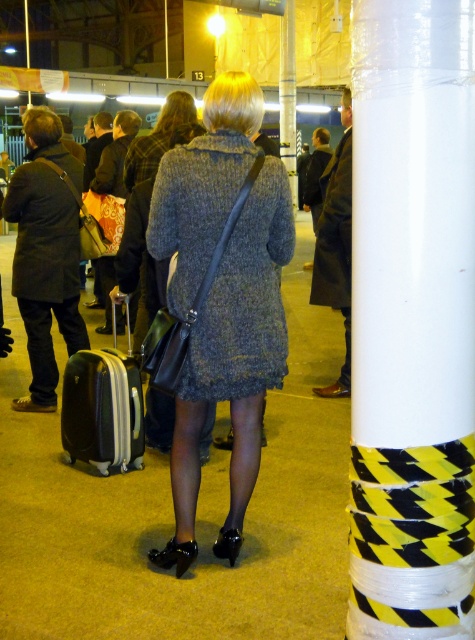
Does black hardshell suitcase at lower left have a greater height compared to white plastic pole at upper center?

Incorrect, black hardshell suitcase at lower left's height is not larger of white plastic pole at upper center's.

Can you confirm if black hardshell suitcase at lower left is positioned above white plastic pole at upper center?

Actually, black hardshell suitcase at lower left is below white plastic pole at upper center.

Which is behind, point (68, 403) or point (296, 195)?

The point (296, 195) is behind.

The width and height of the screenshot is (475, 640). Identify the location of black hardshell suitcase at lower left. (103, 410).

Is knitted wool dress at center wider than white plastic pole at upper center?

No.

Based on the photo, measure the distance between point (167, 228) and camera.

Point (167, 228) is 9.08 feet from camera.

Is point (206, 372) positioned behind point (294, 108)?

No, (206, 372) is closer to viewer.

Where is `knitted wool dress at center`? This screenshot has width=475, height=640. knitted wool dress at center is located at coordinates (250, 289).

Can you confirm if white plastic column at right is wider than black hardshell suitcase at lower left?

In fact, white plastic column at right might be narrower than black hardshell suitcase at lower left.

Between white plastic column at right and black hardshell suitcase at lower left, which one is positioned higher?

Positioned higher is white plastic column at right.

Find the location of a particular element. Image resolution: width=475 pixels, height=640 pixels. white plastic column at right is located at coordinates coord(412,321).